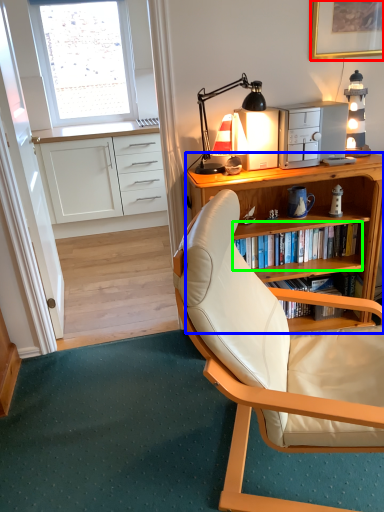
Question: Considering the real-world distances, which object is farthest from picture frame (highlighted by a red box)? desk (highlighted by a blue box) or shelf (highlighted by a green box)?

Choices:
 (A) desk
 (B) shelf

Answer: (B)